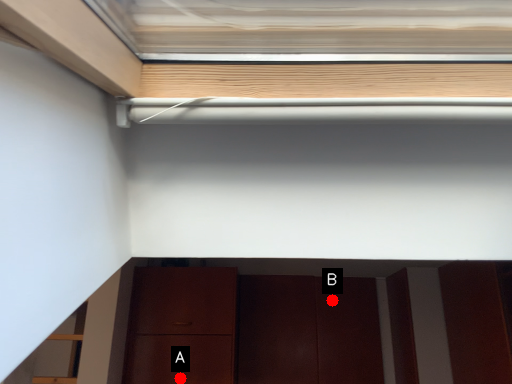
Question: Two points are circled on the image, labeled by A and B beside each circle. Among these points, which one is nearest to the camera?

Choices:
 (A) A is closer
 (B) B is closer

Answer: (A)